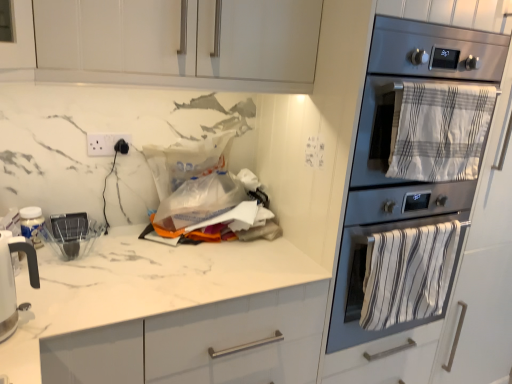
You are a GUI agent. You are given a task and a screenshot of the screen. Output one action in this format:
    pyautogui.click(x=<x>, y=<y>)
    Task: Click on the vacant space underneath white glossy cabinet at upper center (from a real-world perspective)
    This screenshot has width=512, height=384.
    Given the screenshot: What is the action you would take?
    pyautogui.click(x=160, y=246)